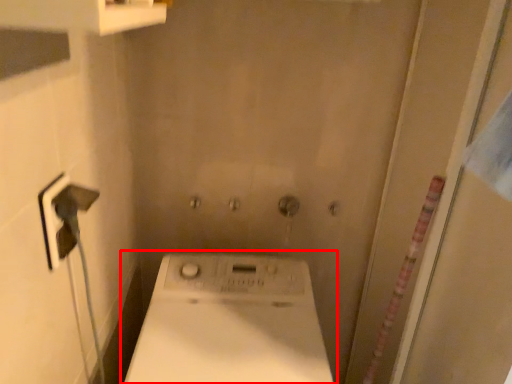
Question: Where is washing machine (annotated by the red box) located in relation to screen door in the image?

Choices:
 (A) right
 (B) left

Answer: (B)